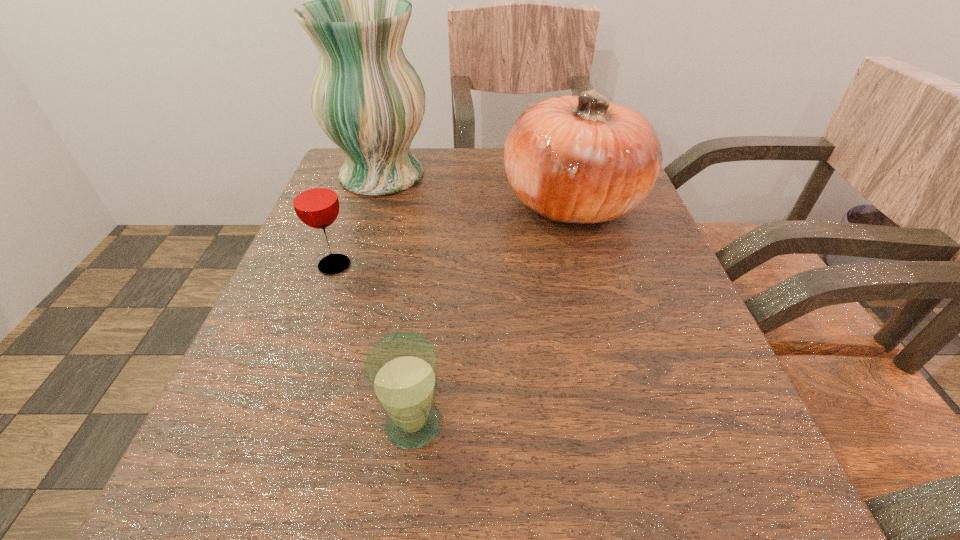
Locate an element on the screen. This screenshot has height=540, width=960. vacant space at the left edge of the desktop is located at coordinates (372, 205).

Image resolution: width=960 pixels, height=540 pixels. I want to click on free point at the right edge, so click(x=605, y=359).

Locate an element on the screen. This screenshot has height=540, width=960. free space at the far left corner is located at coordinates point(394,195).

You are a GUI agent. You are given a task and a screenshot of the screen. Output one action in this format:
    pyautogui.click(x=<x>, y=<y>)
    Task: Click on the vacant area at the near left corner of the desktop
    Image resolution: width=960 pixels, height=540 pixels.
    Given the screenshot: What is the action you would take?
    pyautogui.click(x=262, y=457)

Identify the location of vacant space at the near right corner. (732, 479).

You are a GUI agent. You are given a task and a screenshot of the screen. Output one action in this format:
    pyautogui.click(x=<x>, y=<y>)
    Task: Click on the free area in between the pumpkin and the tallest object
    The width and height of the screenshot is (960, 540).
    Given the screenshot: What is the action you would take?
    477,189

Where is `vacant space that is in between the tallest object and the right glass`? This screenshot has height=540, width=960. vacant space that is in between the tallest object and the right glass is located at coordinates (397, 300).

Where is `empty space between the pumpkin and the tallest object`? The width and height of the screenshot is (960, 540). empty space between the pumpkin and the tallest object is located at coordinates (477, 189).

You are a GUI agent. You are given a task and a screenshot of the screen. Output one action in this format:
    pyautogui.click(x=<x>, y=<y>)
    Task: Click on the free space between the vase and the pumpkin
    Image resolution: width=960 pixels, height=540 pixels.
    Given the screenshot: What is the action you would take?
    pyautogui.click(x=477, y=189)

Identify the location of unoccupied area between the nearest object and the tallest object. (397, 300).